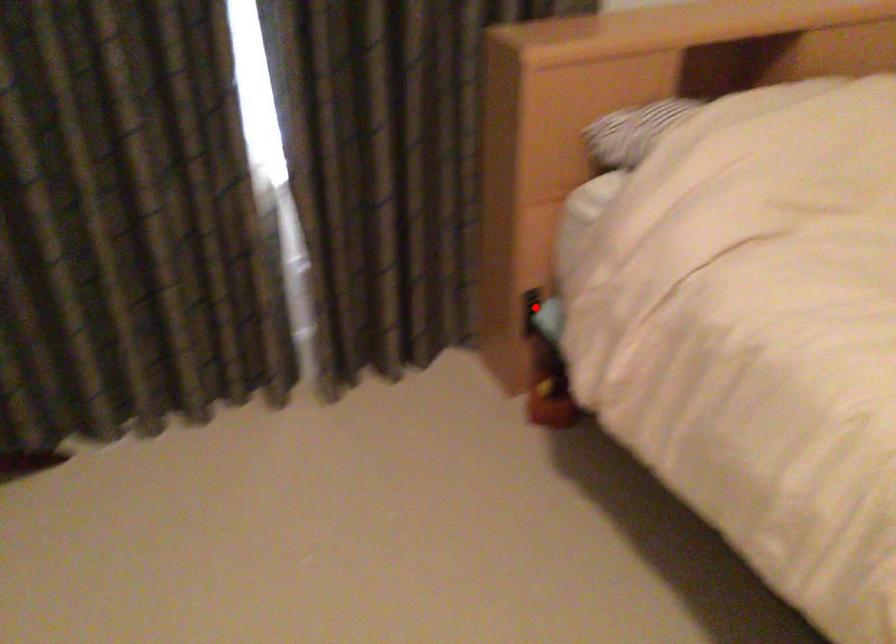
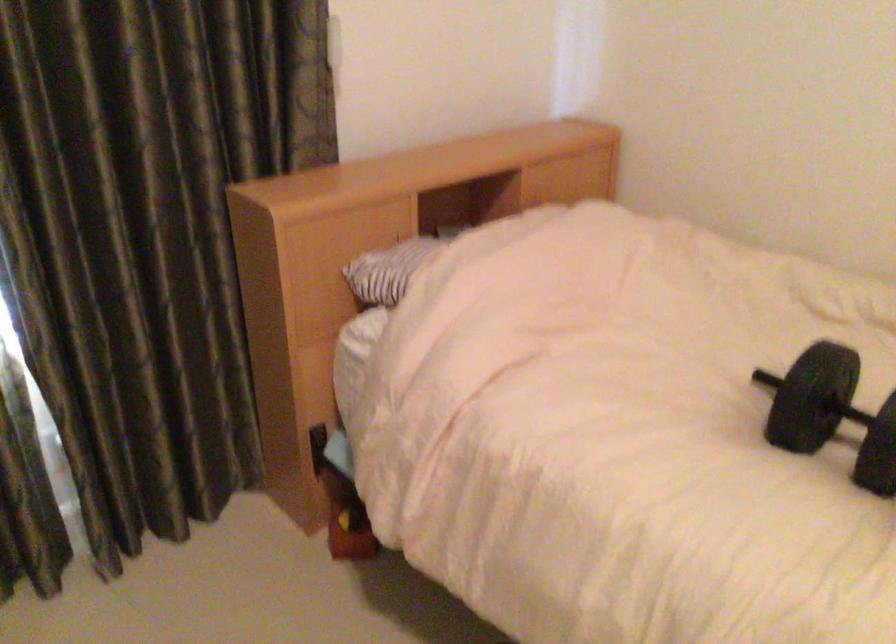
The point at the highlighted location is marked in the first image. Where is the corresponding point in the second image?

(317, 447)